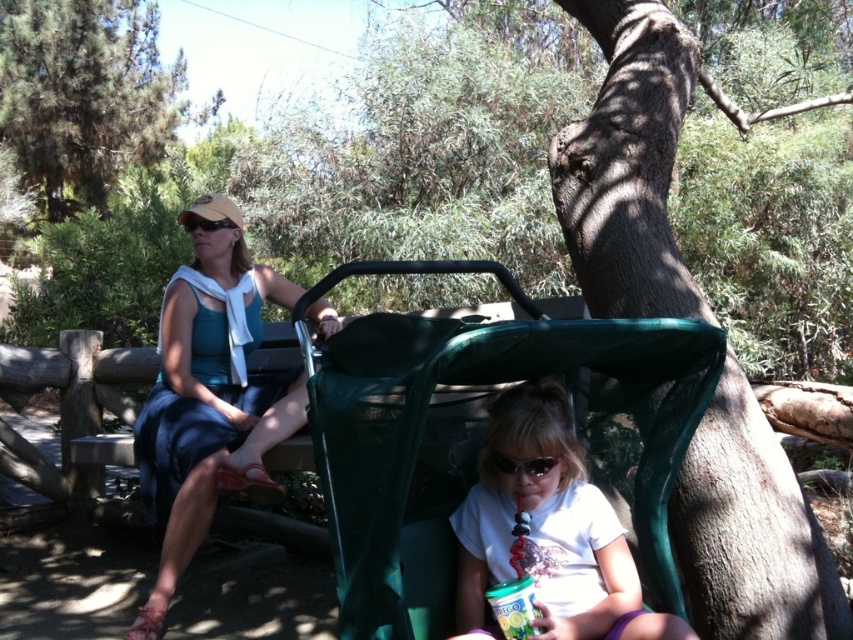
Question: Does matte blue dress at center have a lesser width compared to white matte shirt at center?

Choices:
 (A) yes
 (B) no

Answer: (B)

Question: Where is matte blue dress at center located in relation to white matte shirt at center in the image?

Choices:
 (A) above
 (B) below

Answer: (A)

Question: Which object is positioned farthest from the matte blue dress at center?

Choices:
 (A) green leafy tree at upper left
 (B) black plastic goggles at lower center

Answer: (A)

Question: Which point is closer to the camera?

Choices:
 (A) (422, 477)
 (B) (497, 464)
 (C) (102, 49)
 (D) (477, 593)

Answer: (B)

Question: Which of these objects is positioned closest to the white matte shirt at center?

Choices:
 (A) green mesh stroller at center
 (B) matte blue dress at center

Answer: (A)

Question: Can you confirm if white matte shirt at center is wider than green leafy tree at upper left?

Choices:
 (A) no
 (B) yes

Answer: (A)